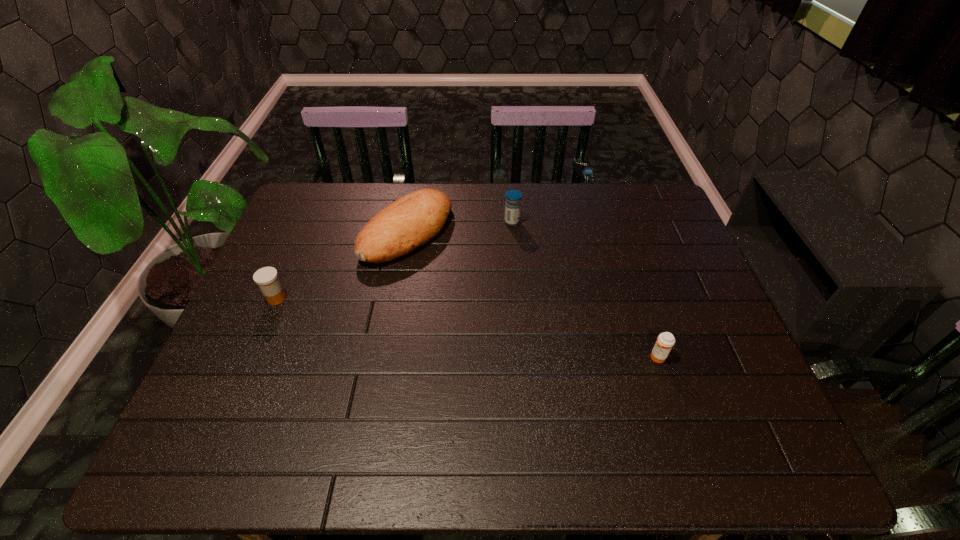
Identify the location of free spot at the far right corner of the desktop. This screenshot has width=960, height=540. (641, 184).

Where is `free space between the leftmost medicine and the farthest medicine`? The image size is (960, 540). free space between the leftmost medicine and the farthest medicine is located at coordinates (395, 260).

Locate an element on the screen. unoccupied position between the rightmost object and the leftmost medicine is located at coordinates (467, 328).

Identify the location of vacant area that lies between the second nearest medicine and the third object from right to left. (342, 265).

In order to click on free space between the leftmost medicine and the nearest medicine in this screenshot , I will do `click(467, 328)`.

Where is `vacant space in between the rightmost medicine and the third object from left to right`? The image size is (960, 540). vacant space in between the rightmost medicine and the third object from left to right is located at coordinates (585, 289).

The height and width of the screenshot is (540, 960). I want to click on empty space between the nearest medicine and the bread, so click(x=532, y=295).

At what (x,y) coordinates should I click in order to perform the action: click on free space between the second object from left to right and the farthest medicine. Please return your answer as a coordinate pair (x, y). The width and height of the screenshot is (960, 540). Looking at the image, I should click on (460, 227).

You are a GUI agent. You are given a task and a screenshot of the screen. Output one action in this format:
    pyautogui.click(x=<x>, y=<y>)
    Task: Click on the empty space that is in between the farthest medicine and the bread
    
    Given the screenshot: What is the action you would take?
    pyautogui.click(x=460, y=227)

Locate an element on the screen. This screenshot has height=540, width=960. unoccupied area between the leftmost object and the rightmost object is located at coordinates (467, 328).